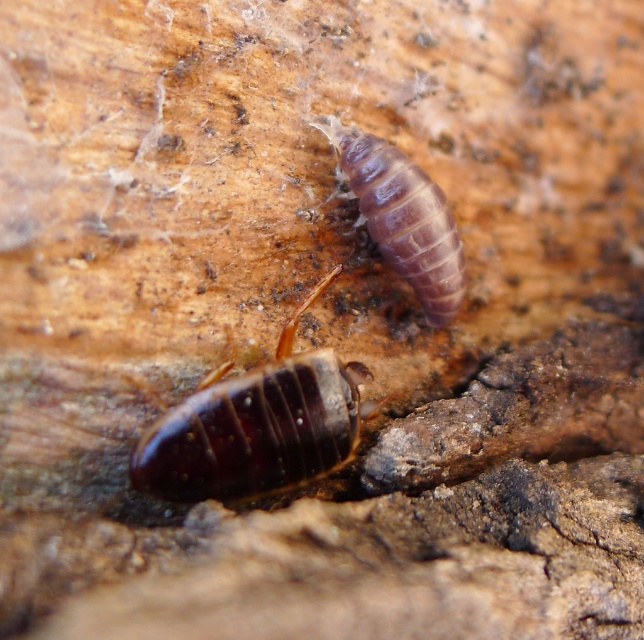
Does point (330, 272) come behind point (383, 221)?

No, (330, 272) is in front of (383, 221).

Who is lower down, shiny dark brown beetle at center or purple matte worm at upper center?

shiny dark brown beetle at center

Between point (189, 451) and point (359, 144), which one is positioned in front?

Point (189, 451)

I want to click on shiny dark brown beetle at center, so click(256, 426).